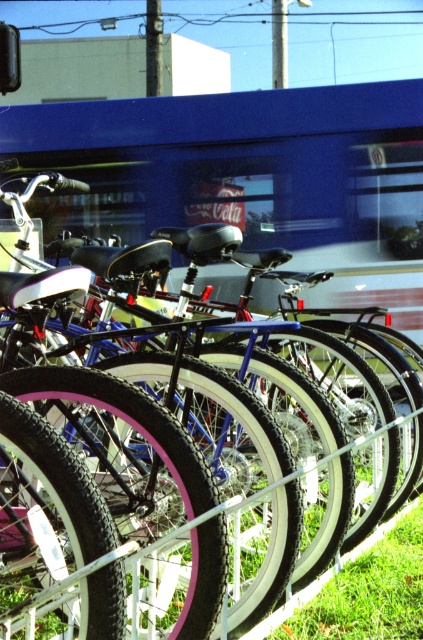
Is blue reflective train at center above pink rubber bicycle at center?

Indeed, blue reflective train at center is positioned over pink rubber bicycle at center.

Which is in front, point (169, 99) or point (46, 266)?

Point (46, 266) is in front.

The image size is (423, 640). Describe the element at coordinates (247, 177) in the screenshot. I see `blue reflective train at center` at that location.

Find the location of a particular element. The height and width of the screenshot is (640, 423). blue reflective train at center is located at coordinates (247, 177).